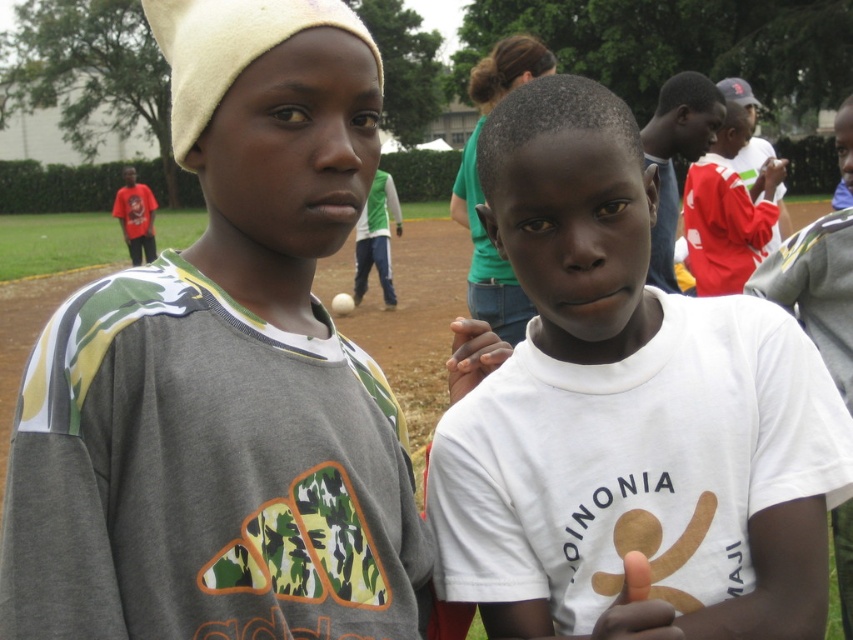
You are a photographer adjusting your camera focus. You want to capture both the white matte shirt at center and the white matte baseball at center in sharp focus. Which object should you focus on first to ensure both are in focus?

You should focus on the white matte shirt at center first since it is closer to the viewer than the white matte baseball at center, allowing the depth of field to cover both objects.